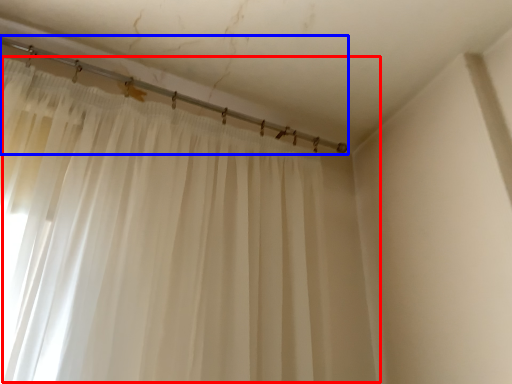
Question: Among these objects, which one is nearest to the camera, curtain (highlighted by a red box) or beam (highlighted by a blue box)?

Choices:
 (A) curtain
 (B) beam

Answer: (A)